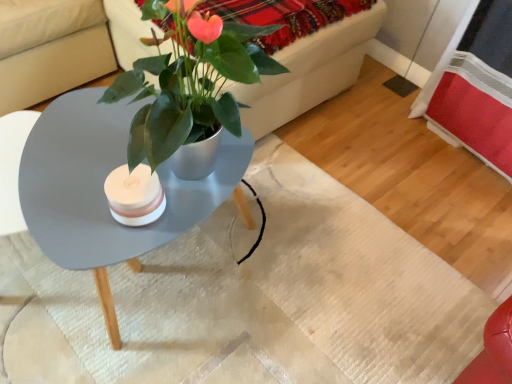
I want to click on velvet red blanket at upper center, so click(x=285, y=16).

What do you see at coordinates (103, 190) in the screenshot? I see `matte gray coffee table at center` at bounding box center [103, 190].

Find the location of a particular element. This screenshot has width=512, height=384. velvet red blanket at upper center is located at coordinates coord(285,16).

From the image's perspective, who appears lower, metallic green plant at center or velvet red blanket at upper center?

velvet red blanket at upper center.

Is metallic green plant at center directly adjacent to velvet red blanket at upper center?

metallic green plant at center and velvet red blanket at upper center are not in contact.

From a real-world perspective, is metallic green plant at center positioned above or below velvet red blanket at upper center?

From a real-world perspective, metallic green plant at center is physically below velvet red blanket at upper center.

Considering the sizes of metallic green plant at center and velvet red blanket at upper center in the image, is metallic green plant at center wider or thinner than velvet red blanket at upper center?

metallic green plant at center is wider than velvet red blanket at upper center.

From a real-world perspective, between matte gray coffee table at center and velvet red blanket at upper center, who is vertically higher?

velvet red blanket at upper center is physically above.

Is matte gray coffee table at center looking in the opposite direction of velvet red blanket at upper center?

That's not correct — matte gray coffee table at center is not looking away from velvet red blanket at upper center.

From the image's perspective, relative to velvet red blanket at upper center, is matte gray coffee table at center above or below?

From the image's perspective, matte gray coffee table at center appears below velvet red blanket at upper center.

Between point (275, 11) and point (278, 63), which one is positioned in front?

Point (275, 11)

Is velvet red blanket at upper center closer to camera compared to metallic green plant at center?

No.

How distant is velvet red blanket at upper center from metallic green plant at center?

5.71 inches.

Is velvet red blanket at upper center not near metallic green plant at center?

Actually, velvet red blanket at upper center and metallic green plant at center are a little close together.

Considering the sizes of objects matte gray coffee table at center and metallic green plant at center in the image provided, who is thinner, matte gray coffee table at center or metallic green plant at center?

Thinner between the two is matte gray coffee table at center.

Who is smaller, matte gray coffee table at center or metallic green plant at center?

Smaller between the two is matte gray coffee table at center.

From a real-world perspective, is matte gray coffee table at center physically above metallic green plant at center?

No, from a real-world perspective, matte gray coffee table at center is not above metallic green plant at center.

Choose the correct answer: Is matte gray coffee table at center inside metallic green plant at center or outside it?

matte gray coffee table at center is spatially situated outside metallic green plant at center.

Considering the points (185, 20) and (75, 162), which point is in front, point (185, 20) or point (75, 162)?

The point (185, 20) is closer to the camera.

Is metallic green plant at center in front of matte gray coffee table at center?

No, metallic green plant at center is further to the viewer.

From a real-world perspective, is metallic green plant at center physically located above or below matte gray coffee table at center?

metallic green plant at center is above matte gray coffee table at center.

Is metallic green plant at center bigger than matte gray coffee table at center?

Yes.

Consider the image. Considering the sizes of objects velvet red blanket at upper center and matte gray coffee table at center in the image provided, who is smaller, velvet red blanket at upper center or matte gray coffee table at center?

Smaller between the two is velvet red blanket at upper center.

Is velvet red blanket at upper center with matte gray coffee table at center?

There is a gap between velvet red blanket at upper center and matte gray coffee table at center.

Is velvet red blanket at upper center located outside matte gray coffee table at center?

velvet red blanket at upper center lies outside matte gray coffee table at center's area.

Considering the relative sizes of velvet red blanket at upper center and matte gray coffee table at center in the image provided, is velvet red blanket at upper center wider than matte gray coffee table at center?

No.

Find the location of `blanket below the metallic green plant at center (from the image's perspective)`. blanket below the metallic green plant at center (from the image's perspective) is located at coordinates (285, 16).

Locate an element on the screen. blanket that appears behind the matte gray coffee table at center is located at coordinates (285, 16).

Considering their positions, is matte gray coffee table at center positioned closer to velvet red blanket at upper center than metallic green plant at center?

metallic green plant at center.

Estimate the real-world distances between objects in this image. Which object is further from matte gray coffee table at center, metallic green plant at center or velvet red blanket at upper center?

Among the two, velvet red blanket at upper center is located further to matte gray coffee table at center.

Based on their spatial positions, is metallic green plant at center or matte gray coffee table at center closer to velvet red blanket at upper center?

metallic green plant at center.

Estimate the real-world distances between objects in this image. Which object is closer to matte gray coffee table at center, velvet red blanket at upper center or metallic green plant at center?

metallic green plant at center.

Which object lies further to the anchor point metallic green plant at center, matte gray coffee table at center or velvet red blanket at upper center?

Based on the image, matte gray coffee table at center appears to be further to metallic green plant at center.

In the scene shown: When comparing their distances from metallic green plant at center, does velvet red blanket at upper center or matte gray coffee table at center seem further?

Among the two, matte gray coffee table at center is located further to metallic green plant at center.

The height and width of the screenshot is (384, 512). Identify the location of blanket between metallic green plant at center and matte gray coffee table at center from top to bottom. (285, 16).